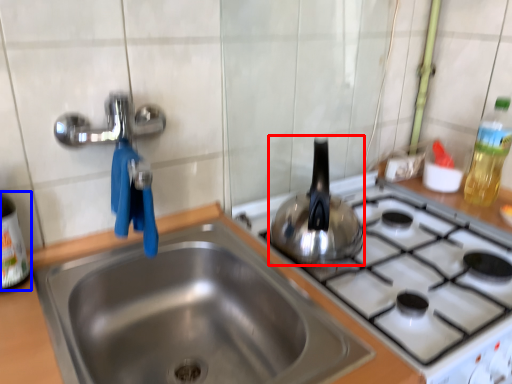
Question: Which point is closer to the camera, tea pot (highlighted by a red box) or bottle (highlighted by a blue box)?

Choices:
 (A) tea pot
 (B) bottle

Answer: (B)